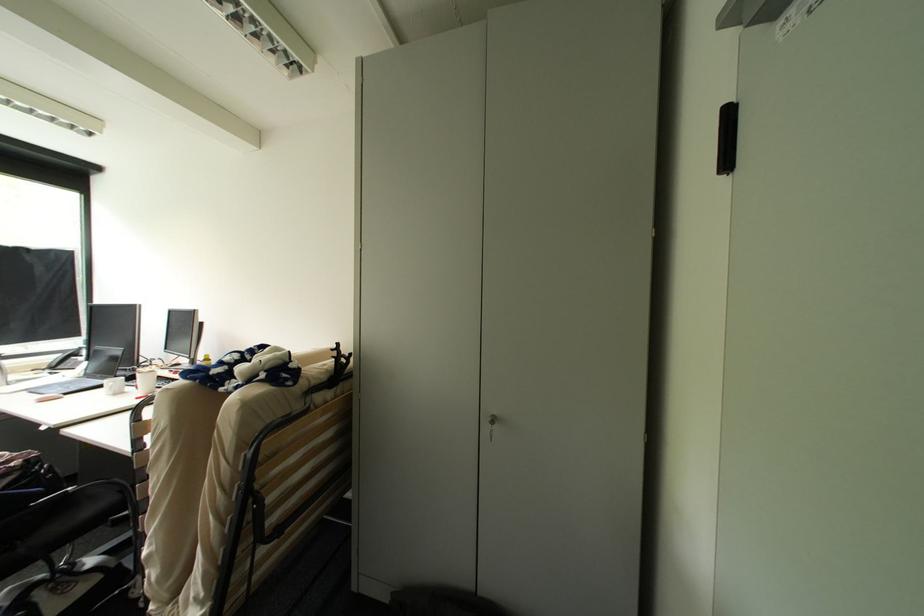
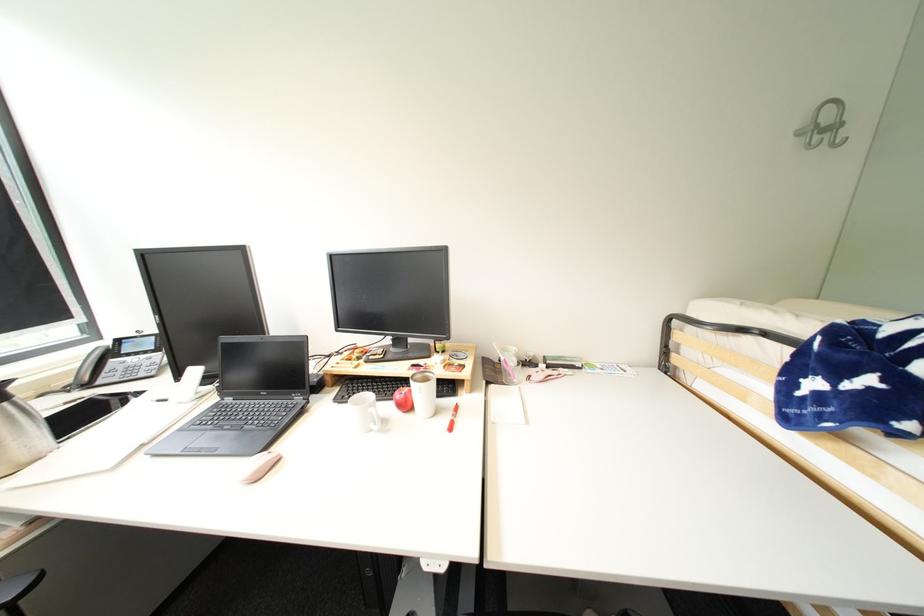
Locate, in the second image, the point that corresponds to point 53,367 in the first image.

(75, 384)